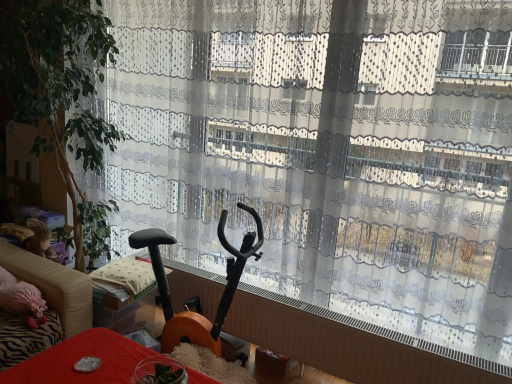
Question: Considering the relative sizes of translucent glass bowl at lower center, the first furniture in the front-to-back sequence, and beige fabric couch at left in the image provided, is translucent glass bowl at lower center, the first furniture in the front-to-back sequence, shorter than beige fabric couch at left?

Choices:
 (A) no
 (B) yes

Answer: (B)

Question: Is translucent glass bowl at lower center, the 2th furniture when ordered from back to front, thinner than beige fabric couch at left?

Choices:
 (A) yes
 (B) no

Answer: (A)

Question: From the image's perspective, is translucent glass bowl at lower center, placed as the 2th furniture when sorted from top to bottom, located above beige fabric couch at left?

Choices:
 (A) yes
 (B) no

Answer: (B)

Question: Can you confirm if translucent glass bowl at lower center, the first furniture in the front-to-back sequence, is taller than beige fabric couch at left?

Choices:
 (A) no
 (B) yes

Answer: (A)

Question: From a real-world perspective, is translucent glass bowl at lower center, the 2th furniture when ordered from back to front, physically below beige fabric couch at left?

Choices:
 (A) yes
 (B) no

Answer: (A)

Question: In terms of height, does green leafy plant at left look taller or shorter compared to translucent glass bowl at lower center, the 2th furniture when ordered from back to front?

Choices:
 (A) short
 (B) tall

Answer: (B)

Question: Is point (56, 109) closer or farther from the camera than point (74, 342)?

Choices:
 (A) farther
 (B) closer

Answer: (A)

Question: In the image, is green leafy plant at left on the left side or the right side of translucent glass bowl at lower center, acting as the first furniture starting from the bottom?

Choices:
 (A) right
 (B) left

Answer: (B)

Question: From a real-world perspective, is green leafy plant at left positioned above or below translucent glass bowl at lower center, the first furniture in the front-to-back sequence?

Choices:
 (A) below
 (B) above

Answer: (B)

Question: Is wooden matte exercise bike at center spatially inside green leafy plant at left, or outside of it?

Choices:
 (A) inside
 (B) outside

Answer: (B)

Question: Is wooden matte exercise bike at center in front of or behind green leafy plant at left in the image?

Choices:
 (A) front
 (B) behind

Answer: (A)

Question: Looking at their shapes, would you say wooden matte exercise bike at center is wider or thinner than green leafy plant at left?

Choices:
 (A) thin
 (B) wide

Answer: (A)

Question: From a real-world perspective, is wooden matte exercise bike at center physically located above or below green leafy plant at left?

Choices:
 (A) above
 (B) below

Answer: (B)

Question: From a real-world perspective, is beige fabric couch at left positioned above or below translucent glass bowl at lower center, the first furniture in the front-to-back sequence?

Choices:
 (A) above
 (B) below

Answer: (A)

Question: Considering the relative positions of beige fabric couch at left and translucent glass bowl at lower center, placed as the 2th furniture when sorted from top to bottom, in the image provided, is beige fabric couch at left to the left or to the right of translucent glass bowl at lower center, placed as the 2th furniture when sorted from top to bottom,?

Choices:
 (A) right
 (B) left

Answer: (B)